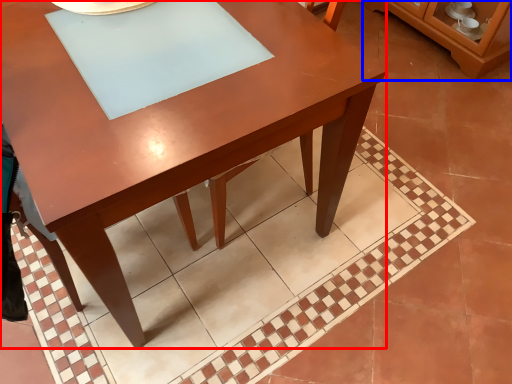
Question: Which point is further to the camera, table (highlighted by a red box) or dresser (highlighted by a blue box)?

Choices:
 (A) table
 (B) dresser

Answer: (B)